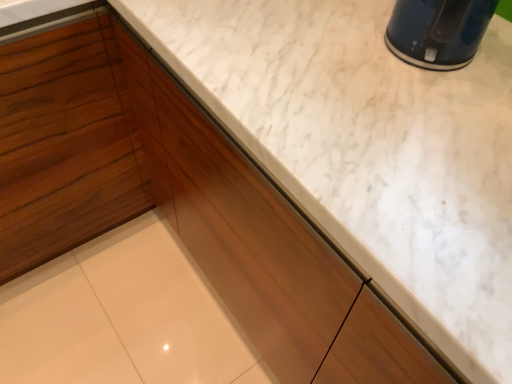
In order to face shiny wood drawer at lower left, should I rotate leftwards or rightwards?

You should look left and rotate roughly 26.276 degrees.

Measure the distance between point (66,200) and camera.

They are 1.20 meters apart.

The image size is (512, 384). What are the coordinates of `shiny wood drawer at lower left` in the screenshot? It's located at (63, 146).

This screenshot has width=512, height=384. What do you see at coordinates (63, 146) in the screenshot?
I see `shiny wood drawer at lower left` at bounding box center [63, 146].

What are the coordinates of `shiny wood drawer at lower left` in the screenshot? It's located at (63, 146).